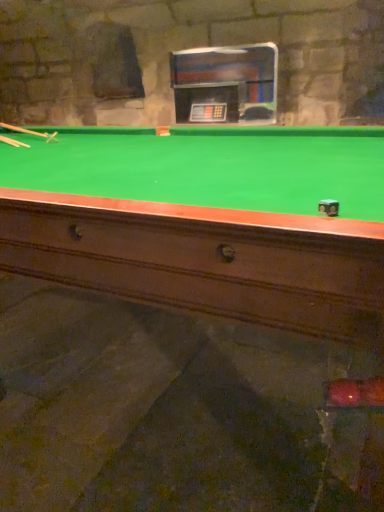
Question: Considering their positions, is wooden cue at left, arranged as the 1th cue when viewed from the top, located in front of or behind wooden cue at left, acting as the second cue starting from the top?

Choices:
 (A) behind
 (B) front

Answer: (A)

Question: From a real-world perspective, is wooden cue at left, arranged as the 1th cue when viewed from the top, physically located above or below wooden cue at left, acting as the second cue starting from the top?

Choices:
 (A) below
 (B) above

Answer: (B)

Question: Looking at their shapes, would you say wooden cue at left, which is the 2th cue in bottom-to-top order, is wider or thinner than wooden cue at left, acting as the second cue starting from the top?

Choices:
 (A) wide
 (B) thin

Answer: (A)

Question: Is wooden cue at left, acting as the second cue starting from the top, bigger or smaller than wooden cue at left, which is the 2th cue in bottom-to-top order?

Choices:
 (A) small
 (B) big

Answer: (A)

Question: Is wooden cue at left, acting as the second cue starting from the top, in front of or behind wooden cue at left, which is the 2th cue in bottom-to-top order, in the image?

Choices:
 (A) front
 (B) behind

Answer: (A)

Question: Is wooden cue at left, acting as the second cue starting from the top, to the left or to the right of wooden cue at left, arranged as the 1th cue when viewed from the top, in the image?

Choices:
 (A) left
 (B) right

Answer: (B)

Question: From a real-world perspective, is wooden cue at left, acting as the second cue starting from the top, above or below wooden cue at left, arranged as the 1th cue when viewed from the top?

Choices:
 (A) above
 (B) below

Answer: (B)